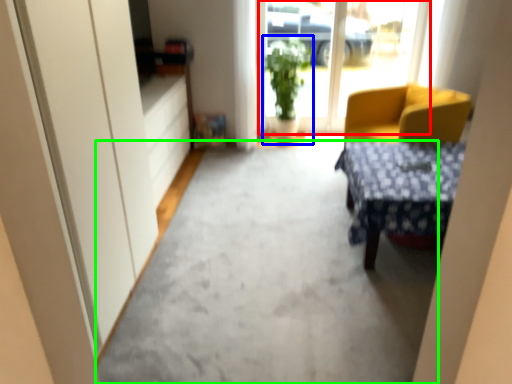
Question: Estimate the real-world distances between objects in this image. Which object is farther from window screen (highlighted by a red box), houseplant (highlighted by a blue box) or concrete (highlighted by a green box)?

Choices:
 (A) houseplant
 (B) concrete

Answer: (B)